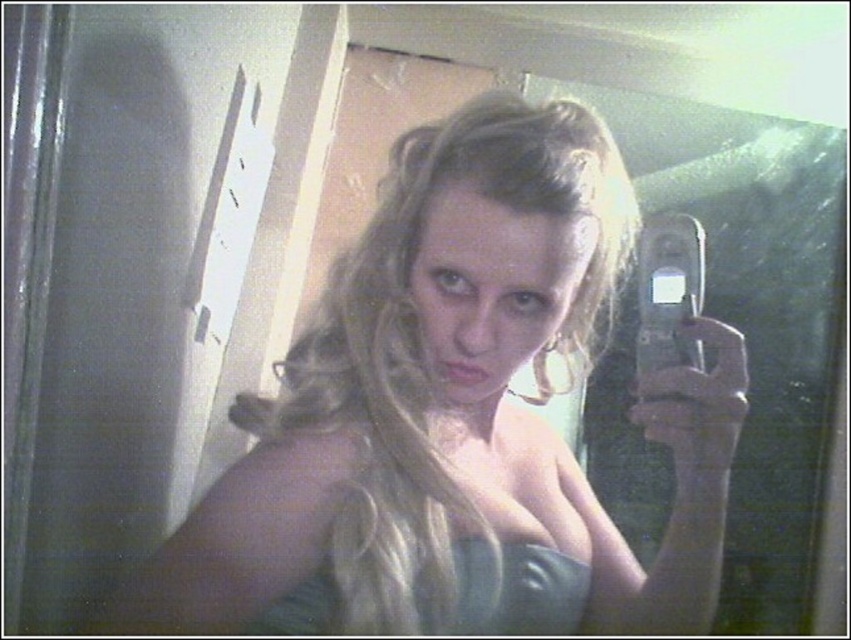
Is matte blue dress at center positioned at the back of satin blue dress at center?

No, matte blue dress at center is closer to the viewer.

Between matte blue dress at center and satin blue dress at center, which one appears on the left side from the viewer's perspective?

From the viewer's perspective, matte blue dress at center appears more on the left side.

Is point (466, 122) closer to viewer compared to point (300, 596)?

Yes.

At what (x,y) coordinates should I click in order to perform the action: click on matte blue dress at center. Please return your answer as a coordinate pair (x, y). Looking at the image, I should click on (455, 417).